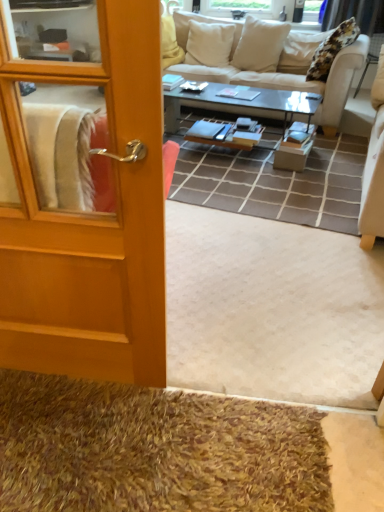
Image resolution: width=384 pixels, height=512 pixels. I want to click on free spot to the right of wooden door at left, so click(213, 340).